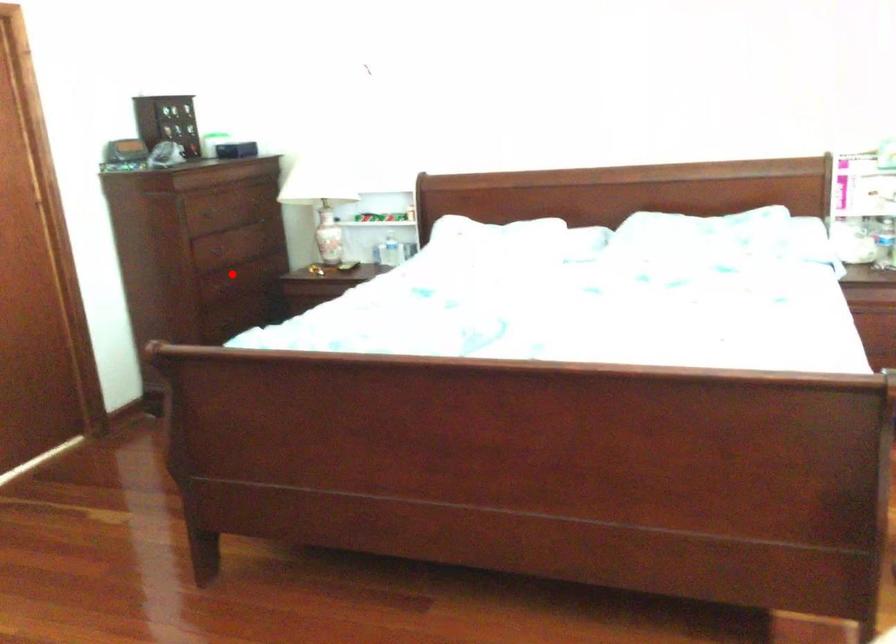
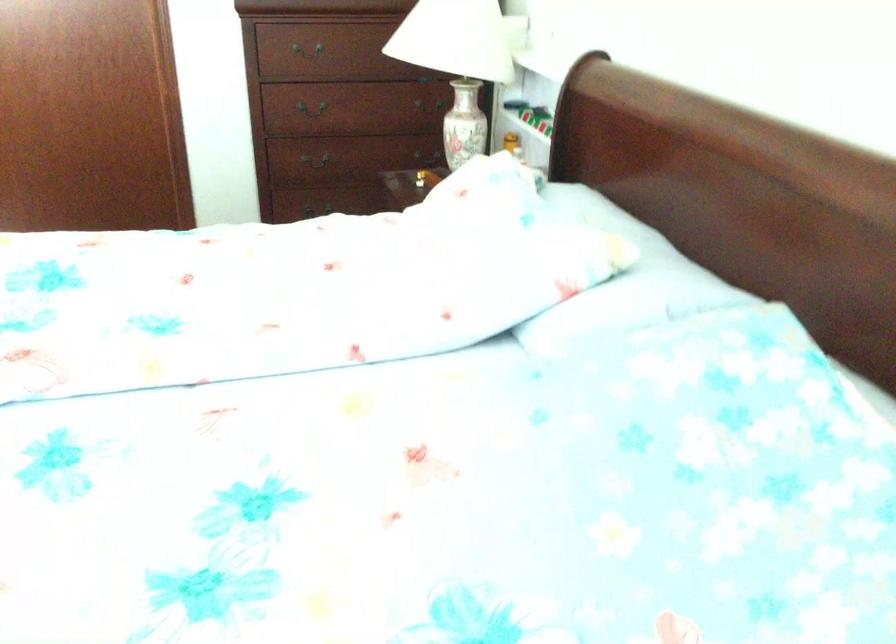
Question: I am providing you with two images of the same scene from different viewpoints. Given a red point in image1, look at the same physical point in image2. Is it:

Choices:
 (A) Closer to the viewpoint
 (B) Farther from the viewpoint

Answer: (A)